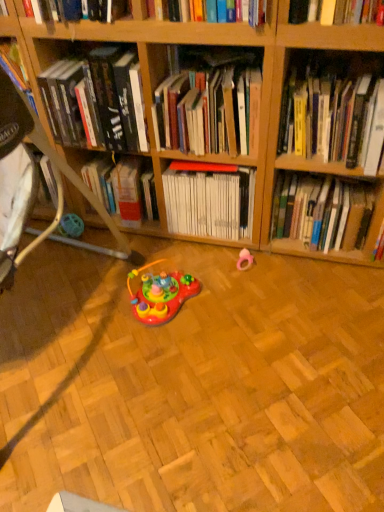
Question: Is point (324, 104) closer or farther from the camera than point (175, 147)?

Choices:
 (A) closer
 (B) farther

Answer: (A)

Question: From a real-world perspective, relative to hardcover books at center, positioned as the second book in left-to-right order, is yellow hardcover book at upper right, the 2th book positioned from the right, vertically above or below?

Choices:
 (A) below
 (B) above

Answer: (A)

Question: Estimate the real-world distances between objects in this image. Which object is closer to the shiny plastic toy at center, which is the first toy in left-to-right order?

Choices:
 (A) yellow hardcover book at upper right, the 2th book positioned from the right
 (B) white matte book at center, which appears as the third book when viewed from the left
 (C) pink rubber ring at center, the 2th toy when ordered from left to right
 (D) hardcover book at upper center, the 5th book when ordered from right to left
 (E) hardcover book at center, which is the 1th book in right-to-left order

Answer: (B)

Question: Based on their relative distances, which object is nearer to the hardcover book at center, which is the 1th book in right-to-left order?

Choices:
 (A) yellow hardcover book at upper right, the 2th book positioned from the right
 (B) pink rubber ring at center, which is the first toy in right-to-left order
 (C) white matte book at center, which appears as the third book when viewed from the left
 (D) hardcover books at center, the 4th book from the right
 (E) hardcover book at upper center, the 1th book in the left-to-right sequence

Answer: (A)